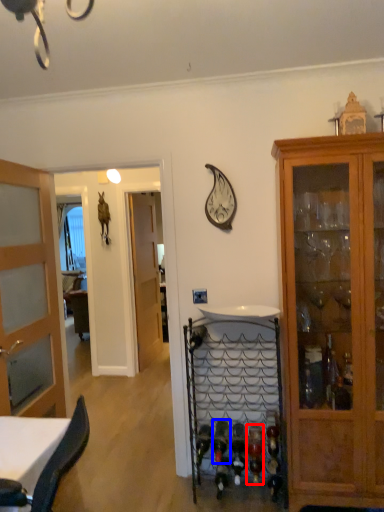
Question: Among these objects, which one is nearest to the camera, wine bottle (highlighted by a red box) or wine bottle (highlighted by a blue box)?

Choices:
 (A) wine bottle
 (B) wine bottle

Answer: (A)